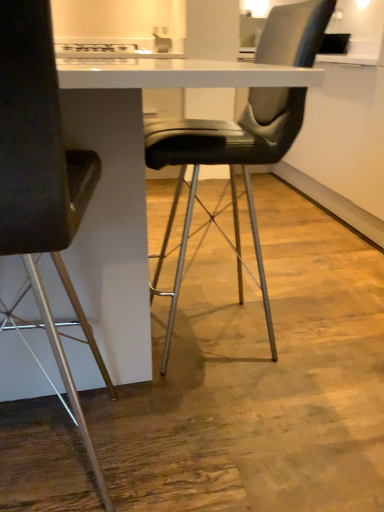
At what (x,y) coordinates should I click in order to perform the action: click on vacant space to the right of matte black chair at left, which is the second chair in right-to-left order. Please return your answer as a coordinate pair (x, y). The width and height of the screenshot is (384, 512). Looking at the image, I should click on (200, 441).